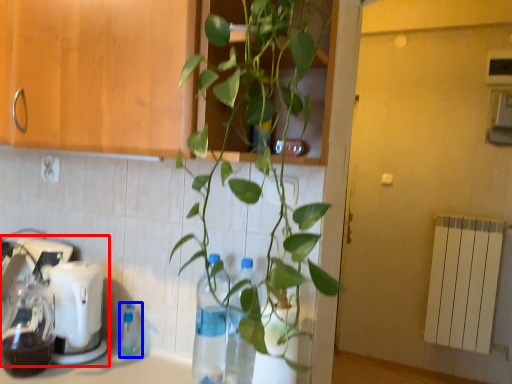
Question: Which of the following is the closest to the observer, mixer (highlighted by a red box) or bottle (highlighted by a blue box)?

Choices:
 (A) mixer
 (B) bottle

Answer: (A)